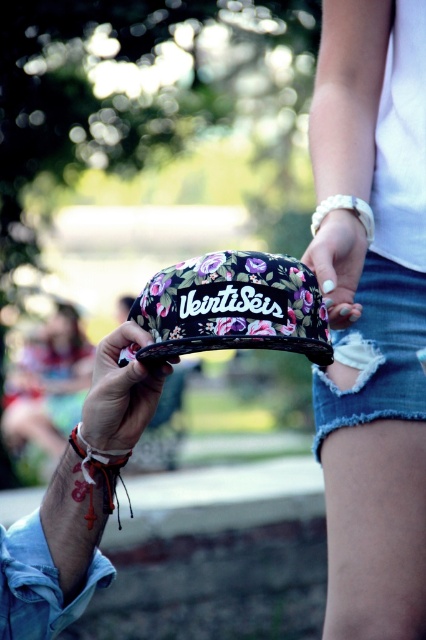
How much distance is there between floral-patterned fabric cap at lower left and white string bracelet at lower left?

floral-patterned fabric cap at lower left is 2.34 inches from white string bracelet at lower left.

Who is more forward, [65,560] or [127,456]?

Point [65,560] is in front.

Locate an element on the screen. This screenshot has height=640, width=426. floral-patterned fabric cap at lower left is located at coordinates (54, 556).

Looking at this image, who is lower down, denim shorts at lower right or floral fabric hand at center?

denim shorts at lower right is lower down.

Between denim shorts at lower right and floral fabric hand at center, which one has less height?

Standing shorter between the two is floral fabric hand at center.

Where is `denim shorts at lower right`? denim shorts at lower right is located at coordinates point(377,353).

The width and height of the screenshot is (426, 640). Identify the location of denim shorts at lower right. (377, 353).

Is floral fabric cap at center thinner than floral-patterned fabric cap at lower center?

In fact, floral fabric cap at center might be wider than floral-patterned fabric cap at lower center.

Can you confirm if floral fabric cap at center is positioned below floral-patterned fabric cap at lower center?

No.

Is point (412, 323) farther from viewer compared to point (126, 424)?

Yes, point (412, 323) is behind point (126, 424).

You are a GUI agent. You are given a task and a screenshot of the screen. Output one action in this format:
    pyautogui.click(x=<x>, y=<y>)
    Task: Click on the floral fabric cap at center
    The width and height of the screenshot is (426, 640).
    Given the screenshot: What is the action you would take?
    pyautogui.click(x=371, y=314)